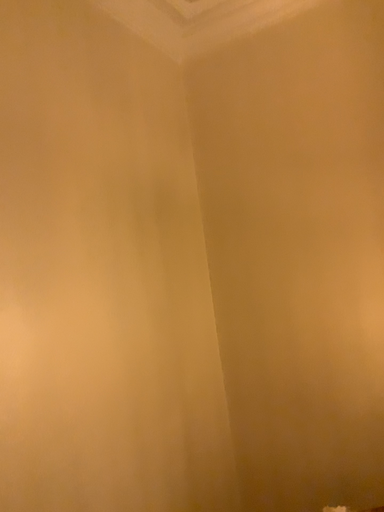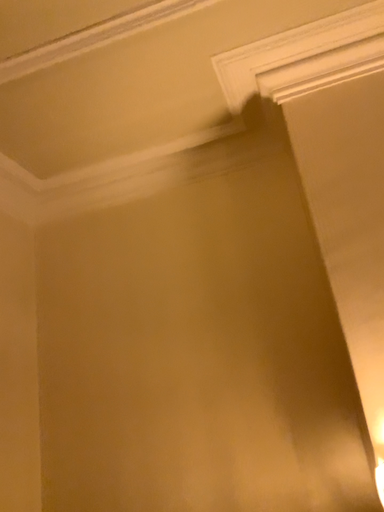
Question: How did the camera likely rotate when shooting the video?

Choices:
 (A) rotated left
 (B) rotated right

Answer: (B)